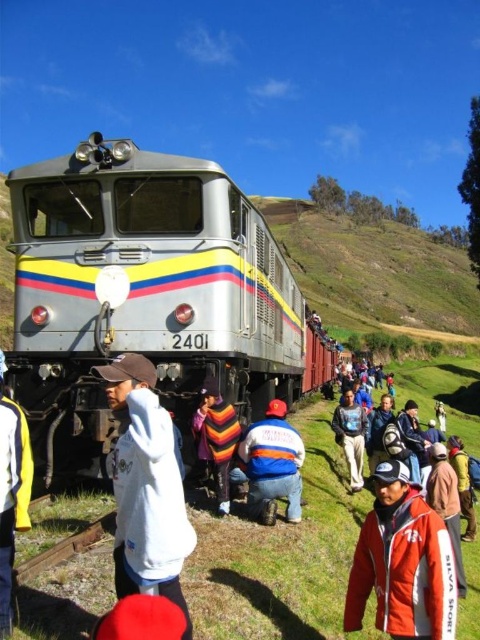
Question: Which point is closer to the camera?

Choices:
 (A) (224, 412)
 (B) (414, 538)
 (C) (20, 445)

Answer: (C)

Question: Considering the relative positions of silver metallic train at center and white fleece jacket at center in the image provided, where is silver metallic train at center located with respect to white fleece jacket at center?

Choices:
 (A) left
 (B) right

Answer: (A)

Question: Does silver metallic train at center appear under orange softshell jacket at center?

Choices:
 (A) no
 (B) yes

Answer: (A)

Question: Which point appears closest to the camera in this image?

Choices:
 (A) (152, 461)
 (B) (216, 490)
 (C) (107, 224)

Answer: (A)

Question: Does white fleece jacket at center appear on the right side of blue denim jeans at center?

Choices:
 (A) yes
 (B) no

Answer: (B)

Question: Which of the following is the farthest from the observer?

Choices:
 (A) white fleece jacket at lower left
 (B) white fleece jacket at center

Answer: (A)